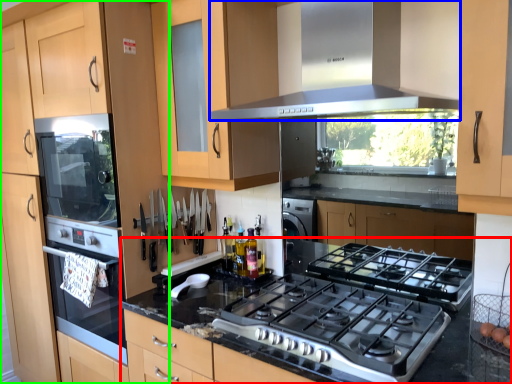
Question: Considering the real-world distances, which object is farthest from countertop (highlighted by a red box)? home appliance (highlighted by a blue box) or cabinetry (highlighted by a green box)?

Choices:
 (A) home appliance
 (B) cabinetry

Answer: (B)